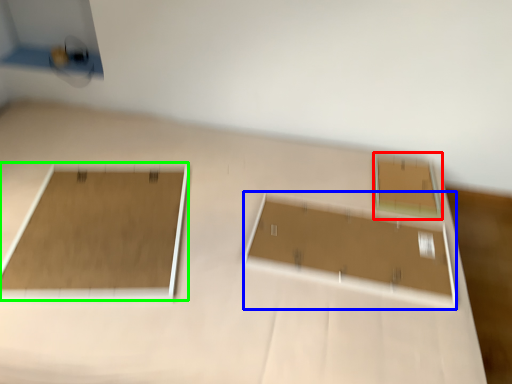
Question: Which object is the farthest from rectangle (highlighted by a red box)? Choose among these: rectangle (highlighted by a blue box) or rectangle (highlighted by a green box).

Choices:
 (A) rectangle
 (B) rectangle

Answer: (B)